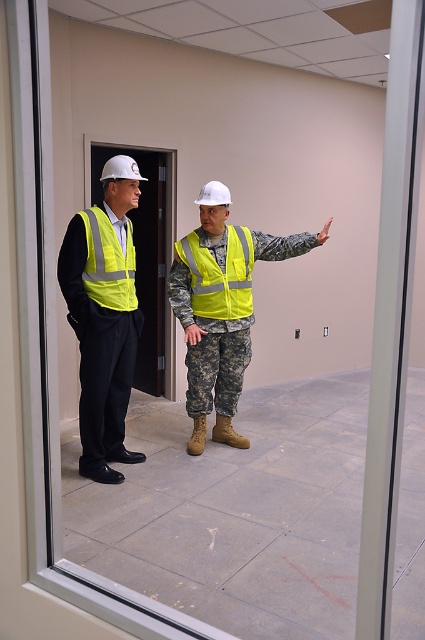
Between matte yellow vest at left and high-visibility fabric safety vest at left, which one is positioned lower?

matte yellow vest at left

Does matte yellow vest at left appear on the right side of high-visibility fabric safety vest at left?

No, matte yellow vest at left is not to the right of high-visibility fabric safety vest at left.

Between point (73, 276) and point (88, 288), which one is positioned in front?

Point (73, 276) is more forward.

What are the coordinates of `matte yellow vest at left` in the screenshot? It's located at (104, 316).

In the scene shown: Does matte yellow vest at left have a lesser height compared to camouflage fabric uniform at center?

In fact, matte yellow vest at left may be taller than camouflage fabric uniform at center.

Who is shorter, matte yellow vest at left or camouflage fabric uniform at center?

camouflage fabric uniform at center

What do you see at coordinates (104, 316) in the screenshot?
I see `matte yellow vest at left` at bounding box center [104, 316].

At what (x,y) coordinates should I click in order to perform the action: click on matte yellow vest at left. Please return your answer as a coordinate pair (x, y). The height and width of the screenshot is (640, 425). Looking at the image, I should click on (104, 316).

Is camouflage fabric uniform at center positioned behind high-visibility fabric safety vest at center?

No, it is in front of high-visibility fabric safety vest at center.

Where is `camouflage fabric uniform at center`? camouflage fabric uniform at center is located at coordinates (221, 307).

Does point (246, 291) lie behind point (223, 282)?

Yes, point (246, 291) is farther from viewer.

The height and width of the screenshot is (640, 425). I want to click on camouflage fabric uniform at center, so click(221, 307).